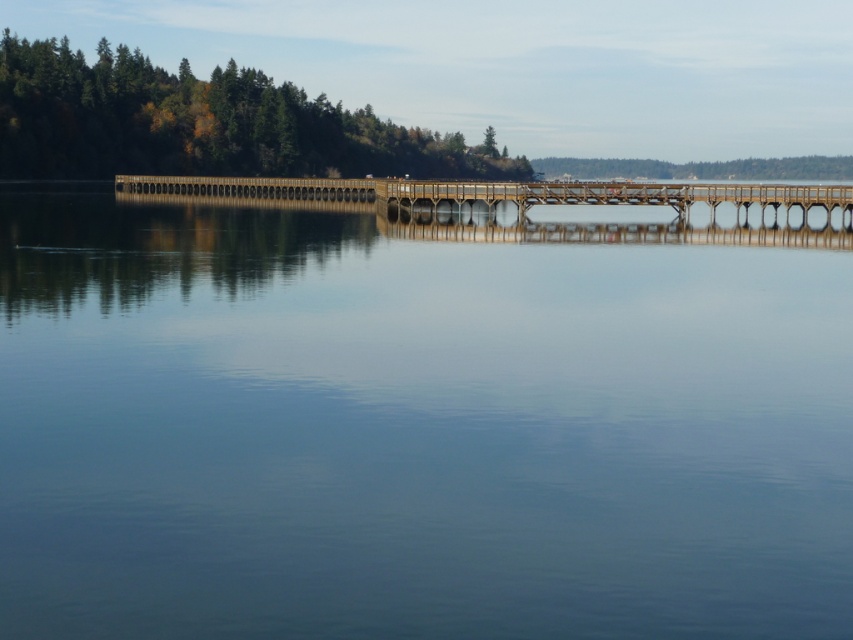
Question: Which object appears farthest from the camera in this image?

Choices:
 (A) brown wooden bridge at center
 (B) transparent glass water at center
 (C) green matte trees at upper left

Answer: (C)

Question: Which object is positioned farthest from the brown wooden bridge at center?

Choices:
 (A) transparent glass water at center
 (B) green matte trees at upper left

Answer: (B)

Question: Is green matte trees at upper left to the right of brown wooden bridge at center from the viewer's perspective?

Choices:
 (A) no
 (B) yes

Answer: (A)

Question: Which object appears farthest from the camera in this image?

Choices:
 (A) green matte trees at upper left
 (B) transparent glass water at center
 (C) brown wooden bridge at center

Answer: (A)

Question: Can you confirm if transparent glass water at center is thinner than brown wooden bridge at center?

Choices:
 (A) yes
 (B) no

Answer: (A)

Question: Is green matte trees at upper left thinner than brown wooden bridge at center?

Choices:
 (A) no
 (B) yes

Answer: (A)